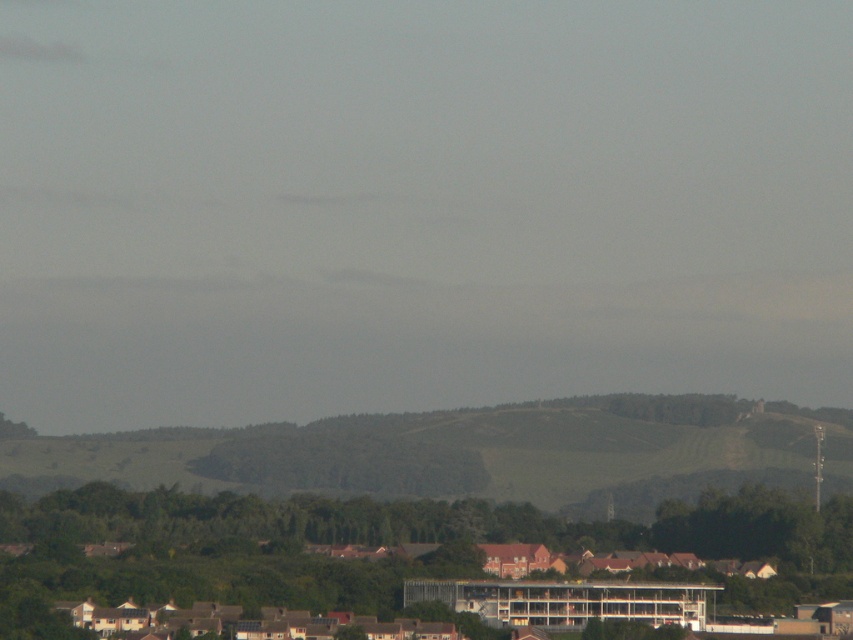
Question: Which point appears closest to the camera in this image?

Choices:
 (A) (573, 410)
 (B) (202, 504)

Answer: (B)

Question: Can you confirm if green leafy tree at lower center is positioned to the right of green grassy hillside at center?

Choices:
 (A) yes
 (B) no

Answer: (A)

Question: Which point is farther to the camera?

Choices:
 (A) green grassy hillside at center
 (B) green leafy tree at lower center

Answer: (A)

Question: Is green leafy tree at lower center thinner than green grassy hillside at center?

Choices:
 (A) yes
 (B) no

Answer: (A)

Question: Which of the following is the farthest from the observer?

Choices:
 (A) 735,502
 (B) 263,468

Answer: (A)

Question: Can you confirm if green leafy tree at lower center is positioned to the left of green grassy hillside at center?

Choices:
 (A) yes
 (B) no

Answer: (B)